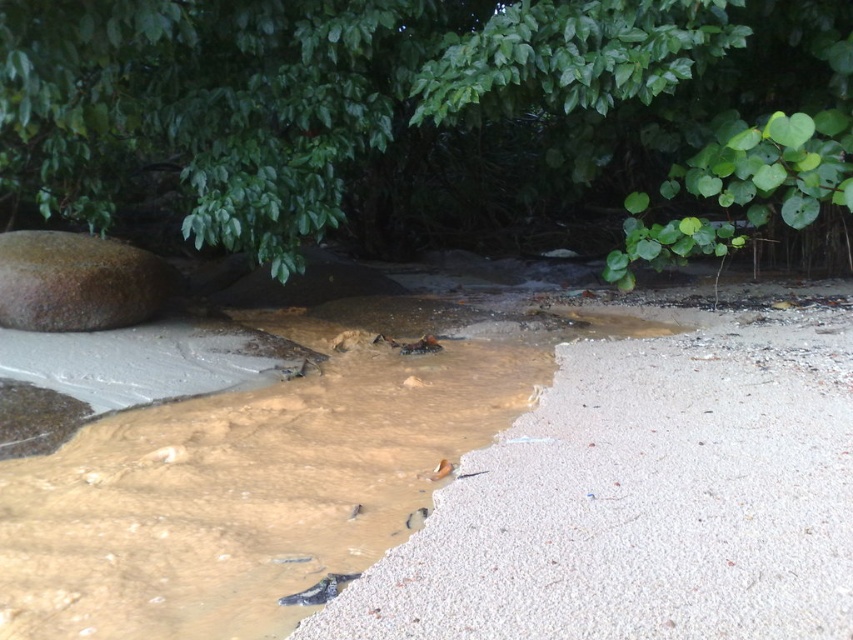
Consider the image. Does brown sandy beach at center have a larger size compared to brown muddy water at center?

No.

Describe the element at coordinates (643, 499) in the screenshot. I see `brown sandy beach at center` at that location.

This screenshot has height=640, width=853. Identify the location of brown sandy beach at center. (643, 499).

How much distance is there between green leafy tree at upper center and brown muddy water at center?

green leafy tree at upper center is 1.21 meters away from brown muddy water at center.

Between point (836, 54) and point (370, 529), which one is positioned in front?

Positioned in front is point (370, 529).

Measure the distance between point (492, 76) and camera.

Point (492, 76) is 3.27 meters away from camera.

Where is `green leafy tree at upper center`? The height and width of the screenshot is (640, 853). green leafy tree at upper center is located at coordinates (427, 116).

Between point (15, 99) and point (76, 282), which one is positioned in front?

Point (15, 99) is in front.

Which is above, green leafy tree at upper center or brown rough boulder at left?

green leafy tree at upper center

Who is more forward, [164,22] or [0,259]?

Positioned in front is point [164,22].

This screenshot has height=640, width=853. Identify the location of green leafy tree at upper center. (427, 116).